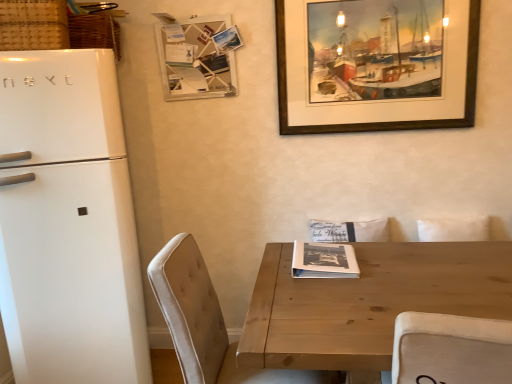
Question: From a real-world perspective, is beige fabric chair at lower left located beneath black paper magazine at center?

Choices:
 (A) yes
 (B) no

Answer: (A)

Question: Is beige fabric chair at lower left to the left of black paper magazine at center from the viewer's perspective?

Choices:
 (A) yes
 (B) no

Answer: (A)

Question: Is beige fabric chair at lower left positioned behind black paper magazine at center?

Choices:
 (A) no
 (B) yes

Answer: (A)

Question: Are beige fabric chair at lower left and black paper magazine at center beside each other?

Choices:
 (A) yes
 (B) no

Answer: (B)

Question: Considering the relative positions of beige fabric chair at lower left and black paper magazine at center in the image provided, is beige fabric chair at lower left in front of black paper magazine at center?

Choices:
 (A) yes
 (B) no

Answer: (A)

Question: From the image's perspective, is wooden table at center positioned above or below white matte refrigerator at left?

Choices:
 (A) below
 (B) above

Answer: (A)

Question: From a real-world perspective, is wooden table at center above or below white matte refrigerator at left?

Choices:
 (A) above
 (B) below

Answer: (B)

Question: Considering their positions, is wooden table at center located in front of or behind white matte refrigerator at left?

Choices:
 (A) behind
 (B) front

Answer: (B)

Question: Is wooden table at center to the left or to the right of white matte refrigerator at left in the image?

Choices:
 (A) right
 (B) left

Answer: (A)

Question: From a real-world perspective, is black paper magazine at center positioned above or below wooden memo board at upper center?

Choices:
 (A) above
 (B) below

Answer: (B)

Question: Would you say black paper magazine at center is to the left or to the right of wooden memo board at upper center in the picture?

Choices:
 (A) right
 (B) left

Answer: (A)

Question: In terms of width, does black paper magazine at center look wider or thinner when compared to wooden memo board at upper center?

Choices:
 (A) wide
 (B) thin

Answer: (A)

Question: Is black paper magazine at center taller or shorter than wooden memo board at upper center?

Choices:
 (A) tall
 (B) short

Answer: (B)

Question: Is wooden picture frame at upper right spatially inside beige fabric chair at lower left, or outside of it?

Choices:
 (A) inside
 (B) outside

Answer: (B)

Question: Is point (378, 122) closer or farther from the camera than point (163, 246)?

Choices:
 (A) closer
 (B) farther

Answer: (B)